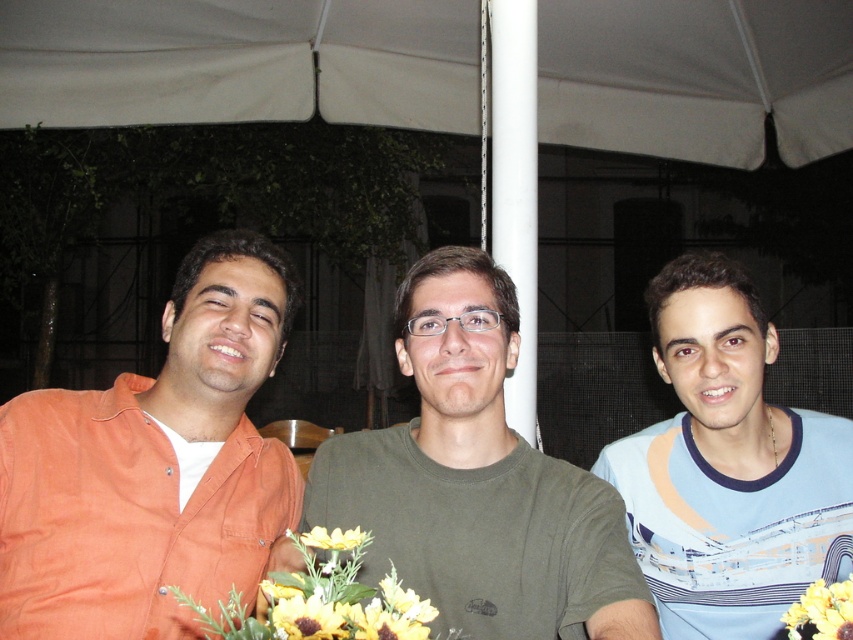
You are a photographer setting up a camera to take a group photo of the three people under the white fabric canopy at upper center. The yellow artificial flowers at center are blocking the camera lens. Can you move the flowers closer to the canopy to get them out of the way without moving the people?

The distance between the white fabric canopy at upper center and the yellow artificial flowers at center is 6.07 feet. Moving the flowers closer would require reducing this distance, but since the flowers are already at the center and the canopy is fixed at the upper center, moving them closer might not be feasible without adjusting the setup. However, if possible, moving the flowers closer to the canopy could help, but ensure they don not obstruct the people.

You are planning to hang a string of fairy lights between the white fabric canopy at upper center and the yellow artificial flowers at center. Based on the scene description, which object is taller and should the lights be hung from the taller one to the shorter one?

The white fabric canopy at upper center is taller than the yellow artificial flowers at center. Therefore, the fairy lights should be hung from the white fabric canopy at upper center down to the yellow artificial flowers at center.

You are a photographer trying to capture a clear shot of the orange cotton shirt at left and the yellow matte flower at center. Which object will appear larger in your photo?

The orange cotton shirt at left will appear larger in the photo because it is closer to the viewer than the yellow matte flower at center.